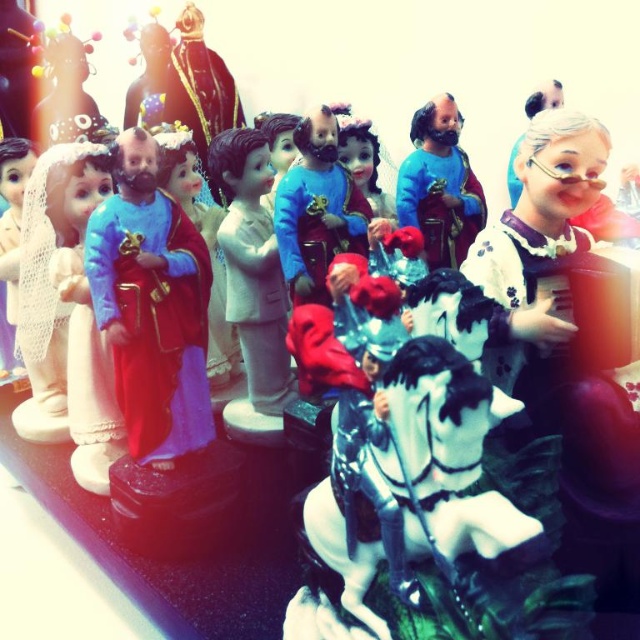
Does white glossy horse at center have a larger size compared to matte plastic figurine at center?

Correct, white glossy horse at center is larger in size than matte plastic figurine at center.

Is point (324, 509) farther from camera compared to point (150, 406)?

That is False.

You are a GUI agent. You are given a task and a screenshot of the screen. Output one action in this format:
    pyautogui.click(x=<x>, y=<y>)
    Task: Click on the white glossy horse at center
    The width and height of the screenshot is (640, 640).
    Given the screenshot: What is the action you would take?
    pyautogui.click(x=419, y=481)

Between blue glossy statue at center and matte black figurine at upper left, which one is positioned higher?

Positioned higher is matte black figurine at upper left.

Does blue glossy statue at center come in front of matte black figurine at upper left?

That is True.

Which is in front, point (419, 125) or point (84, 129)?

Point (419, 125)

This screenshot has width=640, height=640. In order to click on blue glossy statue at center in this screenshot , I will do `click(440, 186)`.

Is matte plastic figurine at center to the right of matte porcelain doll at left from the viewer's perspective?

Indeed, matte plastic figurine at center is positioned on the right side of matte porcelain doll at left.

Between point (157, 317) and point (58, 392), which one is positioned behind?

Positioned behind is point (58, 392).

Between point (202, 435) and point (58, 172), which one is positioned behind?

Point (58, 172)

Image resolution: width=640 pixels, height=640 pixels. I want to click on matte plastic figurine at center, so click(x=150, y=305).